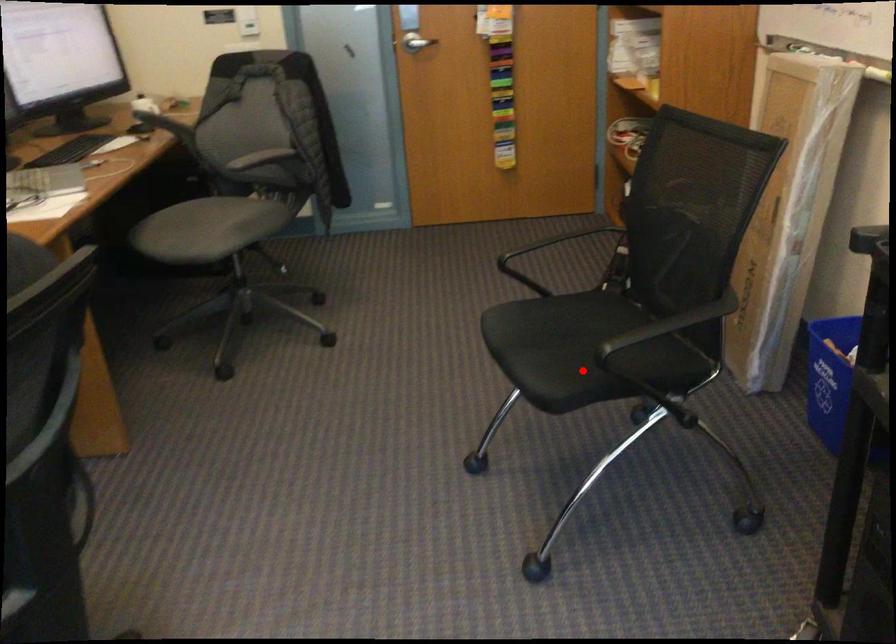
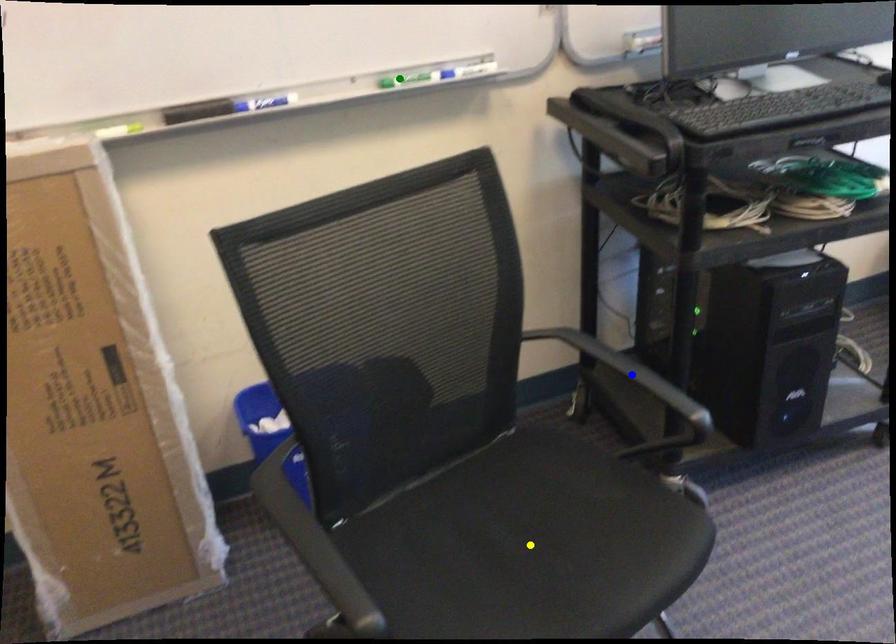
Question: I am providing you with two images of the same scene from different viewpoints. A red point is marked on the first image. You are given multiple points on the second image. Can you choose the point in image 2 that corresponds to the point in image 1?

Choices:
 (A) yellow point
 (B) green point
 (C) blue point

Answer: (A)